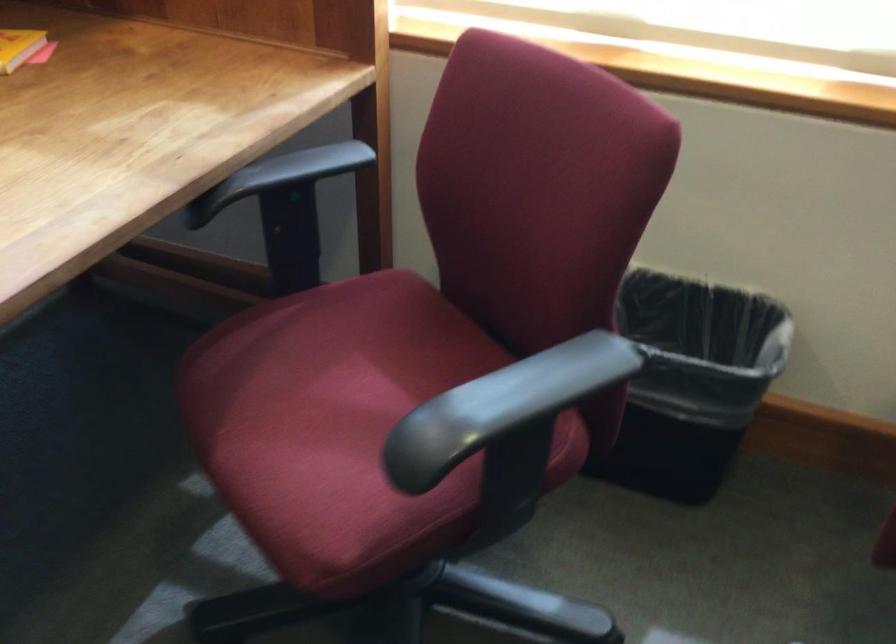
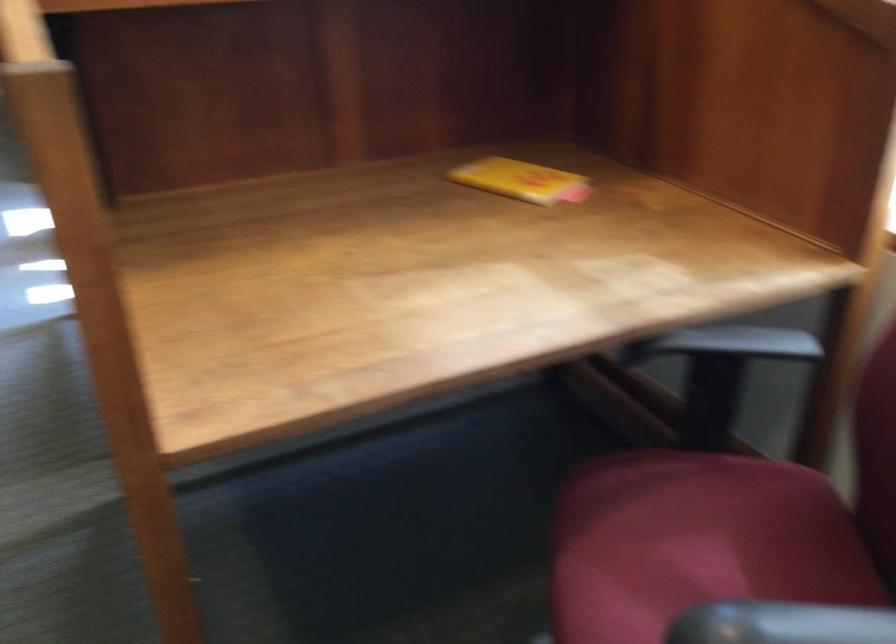
In the second image, find the point that corresponds to (x=347, y=390) in the first image.

(694, 554)